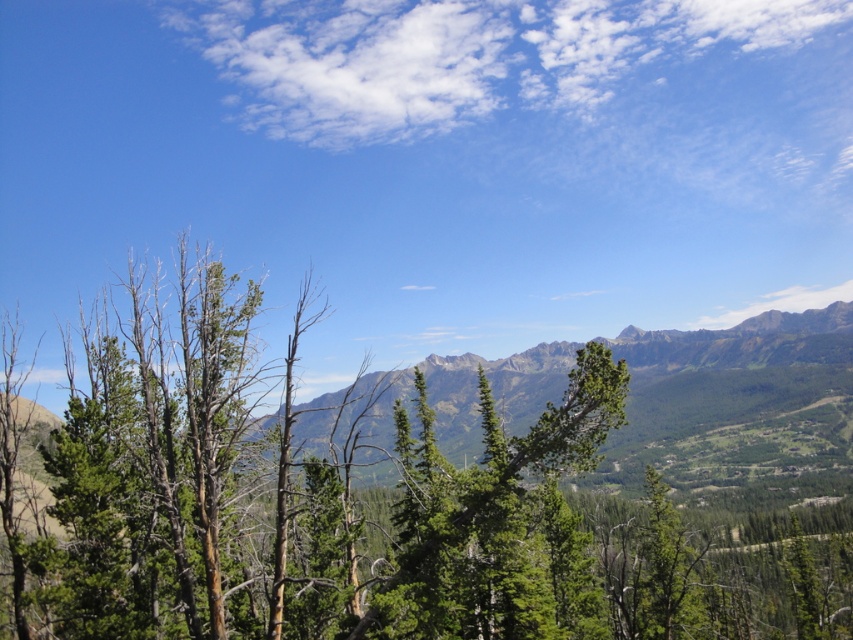
Question: Among these objects, which one is nearest to the camera?

Choices:
 (A) green textured tree at center
 (B) green textured mountain range at center

Answer: (A)

Question: Which of the following is the closest to the observer?

Choices:
 (A) green textured tree at center
 (B) green textured mountain range at center

Answer: (A)

Question: In this image, where is green textured tree at center located relative to green textured mountain range at center?

Choices:
 (A) above
 (B) below

Answer: (A)

Question: Is green textured tree at center thinner than green textured mountain range at center?

Choices:
 (A) no
 (B) yes

Answer: (A)

Question: In this image, where is green textured tree at center located relative to green textured mountain range at center?

Choices:
 (A) above
 (B) below

Answer: (A)